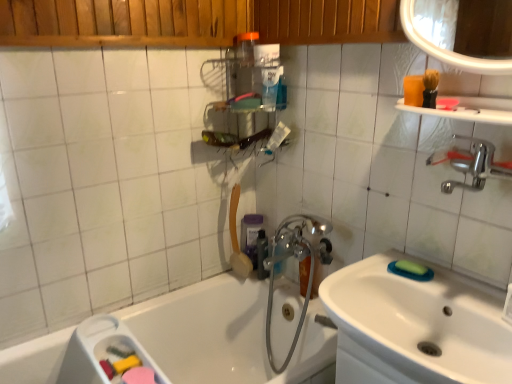
The image size is (512, 384). In order to click on green sponge at sink in this screenshot , I will do `click(411, 268)`.

The height and width of the screenshot is (384, 512). Describe the element at coordinates (416, 326) in the screenshot. I see `white glossy sink at lower right` at that location.

Where is `white glossy sink at lower right`? This screenshot has height=384, width=512. white glossy sink at lower right is located at coordinates (416, 326).

Measure the distance between black plastic bottle at center, placed as the second toiletry when sorted from front to back, and camera.

The distance of black plastic bottle at center, placed as the second toiletry when sorted from front to back, from camera is 1.79 meters.

This screenshot has height=384, width=512. Describe the element at coordinates (262, 254) in the screenshot. I see `black plastic bottle at center, the third toiletry viewed from the top` at that location.

Where is `transparent plastic bottle at upper center, the 1th toiletry positioned from the top`? transparent plastic bottle at upper center, the 1th toiletry positioned from the top is located at coordinates (245, 47).

This screenshot has height=384, width=512. I want to click on green sponge at sink, so click(x=411, y=268).

This screenshot has height=384, width=512. What are the coordinates of `toiletry that is the 3rd one when counting rightward from the matte orange shower head at upper center` in the screenshot? It's located at (262, 254).

Considering the points (262, 272) and (237, 274), which point is in front, point (262, 272) or point (237, 274)?

Positioned in front is point (262, 272).

From the image's perspective, which is below, black plastic bottle at center, the second toiletry positioned from the back, or matte orange shower head at upper center?

black plastic bottle at center, the second toiletry positioned from the back, from the image's perspective.

Which object is further away from the camera, black plastic bottle at center, the third toiletry viewed from the top, or matte orange shower head at upper center?

Positioned behind is black plastic bottle at center, the third toiletry viewed from the top.

From the image's perspective, which is below, chrome metallic faucet at center or green sponge at sink?

chrome metallic faucet at center appears lower in the image.

Is chrome metallic faucet at center bigger or smaller than green sponge at sink?

Clearly, chrome metallic faucet at center is larger in size than green sponge at sink.

Is chrome metallic faucet at center turned away from green sponge at sink?

chrome metallic faucet at center is not turned away from green sponge at sink.

Considering the sizes of objects chrome metallic faucet at center and green sponge at sink in the image provided, who is shorter, chrome metallic faucet at center or green sponge at sink?

Standing shorter between the two is green sponge at sink.

Could you measure the distance between metallic silver shelf at upper center and transparent plastic bottle at upper center, arranged as the first toiletry when viewed from the front?

metallic silver shelf at upper center is 6.39 inches away from transparent plastic bottle at upper center, arranged as the first toiletry when viewed from the front.

From a real-world perspective, which object rests below the other?

metallic silver shelf at upper center is physically lower.

From the image's perspective, who appears lower, metallic silver shelf at upper center or transparent plastic bottle at upper center, the 1th toiletry positioned from the top?

metallic silver shelf at upper center.

Considering the sizes of objects metallic silver shelf at upper center and transparent plastic bottle at upper center, the 3th toiletry in the bottom-to-top sequence, in the image provided, who is smaller, metallic silver shelf at upper center or transparent plastic bottle at upper center, the 3th toiletry in the bottom-to-top sequence,?

Smaller between the two is transparent plastic bottle at upper center, the 3th toiletry in the bottom-to-top sequence.

Is matte orange shower head at upper center far from chrome metallic faucet at center?

No, there isn't a large distance between matte orange shower head at upper center and chrome metallic faucet at center.

Considering the relative sizes of matte orange shower head at upper center and chrome metallic faucet at center in the image provided, is matte orange shower head at upper center wider than chrome metallic faucet at center?

No, matte orange shower head at upper center is not wider than chrome metallic faucet at center.

Is matte orange shower head at upper center further to camera compared to chrome metallic faucet at center?

Yes, it is.

Which object is further away from the camera taking this photo, black plastic bottle at center, the third toiletry viewed from the top, or metallic silver shelf at upper center?

black plastic bottle at center, the third toiletry viewed from the top, is further from the camera.

From a real-world perspective, who is located lower, black plastic bottle at center, the second toiletry positioned from the back, or metallic silver shelf at upper center?

In real-world perspective, black plastic bottle at center, the second toiletry positioned from the back, is lower.

You are a GUI agent. You are given a task and a screenshot of the screen. Output one action in this format:
    pyautogui.click(x=<x>, y=<y>)
    Task: Click on the 2nd toiletry behind the metallic silver shelf at upper center
    The image size is (512, 384).
    Given the screenshot: What is the action you would take?
    pyautogui.click(x=262, y=254)

Would you consider black plastic bottle at center, the first toiletry in the bottom-to-top sequence, to be distant from metallic silver shelf at upper center?

No, there isn't a large distance between black plastic bottle at center, the first toiletry in the bottom-to-top sequence, and metallic silver shelf at upper center.

Which of these two, matte orange shower head at upper center or transparent plastic bottle at upper center, arranged as the first toiletry when viewed from the front, is wider?

Wider between the two is matte orange shower head at upper center.

Between matte orange shower head at upper center and transparent plastic bottle at upper center, the 1th toiletry positioned from the top, which one appears on the left side from the viewer's perspective?

Positioned to the left is matte orange shower head at upper center.

Who is more distant, matte orange shower head at upper center or transparent plastic bottle at upper center, arranged as the first toiletry when viewed from the front?

matte orange shower head at upper center.

Can transparent plastic bottle at upper center, arranged as the first toiletry when viewed from the front, be found inside matte orange shower head at upper center?

No, matte orange shower head at upper center does not contain transparent plastic bottle at upper center, arranged as the first toiletry when viewed from the front.

Does chrome metallic faucet at center come behind white glossy sink at lower right?

Yes, it is behind white glossy sink at lower right.

Would you consider chrome metallic faucet at center to be distant from white glossy sink at lower right?

chrome metallic faucet at center is near white glossy sink at lower right, not far away.

Does point (303, 216) appear closer or farther from the camera than point (446, 321)?

Point (303, 216) appears to be farther away from the viewer than point (446, 321).

Does chrome metallic faucet at center have a smaller size compared to white glossy sink at lower right?

Actually, chrome metallic faucet at center might be larger than white glossy sink at lower right.

Identify the location of shower located in front of the black plastic bottle at center, placed as the second toiletry when sorted from front to back. The height and width of the screenshot is (384, 512). (237, 238).

The height and width of the screenshot is (384, 512). Identify the location of plumbing fixture behind the green sponge at sink. (298, 267).

Estimate the real-world distances between objects in this image. Which object is further from transparent plastic bottle at upper center, which is the 3th toiletry from back to front, white glossy sink at lower right or green sponge at sink?

white glossy sink at lower right lies further to transparent plastic bottle at upper center, which is the 3th toiletry from back to front, than the other object.

When comparing their distances from purple matte soap dispenser at upper center, placed as the 1th toiletry when sorted from back to front, does green sponge at sink or white glossy sink at lower right seem closer?

green sponge at sink is closer to purple matte soap dispenser at upper center, placed as the 1th toiletry when sorted from back to front.

Based on the photo, which object lies further to the anchor point chrome metallic faucet at center, white glossy sink at lower right or transparent plastic bottle at upper center, which is the 3th toiletry from back to front?

transparent plastic bottle at upper center, which is the 3th toiletry from back to front.

Considering their positions, is white glossy sink at lower right positioned closer to transparent plastic bottle at upper center, arranged as the first toiletry when viewed from the front, than chrome metallic faucet at center?

Among the two, chrome metallic faucet at center is located nearer to transparent plastic bottle at upper center, arranged as the first toiletry when viewed from the front.

Which object lies further to the anchor point white glossy sink at lower right, chrome metallic faucet at center or purple matte soap dispenser at upper center, placed as the 1th toiletry when sorted from back to front?

purple matte soap dispenser at upper center, placed as the 1th toiletry when sorted from back to front, lies further to white glossy sink at lower right than the other object.

Considering their positions, is metallic silver shelf at upper center positioned further to chrome metallic faucet at center than matte orange shower head at upper center?

metallic silver shelf at upper center is positioned further to the anchor chrome metallic faucet at center.

Looking at the image, which one is located further to white glossy sink at lower right, transparent plastic bottle at upper center, which is the 3th toiletry from back to front, or black plastic bottle at center, the first toiletry in the bottom-to-top sequence?

Based on the image, transparent plastic bottle at upper center, which is the 3th toiletry from back to front, appears to be further to white glossy sink at lower right.

Estimate the real-world distances between objects in this image. Which object is further from black plastic bottle at center, placed as the second toiletry when sorted from front to back, metallic silver shelf at upper center or chrome metallic faucet at center?

Among the two, metallic silver shelf at upper center is located further to black plastic bottle at center, placed as the second toiletry when sorted from front to back.

Locate an element on the screen. shower between metallic silver shelf at upper center and purple matte soap dispenser at upper center, which ranks as the 2th toiletry in top-to-bottom order, in the up-down direction is located at coordinates (237, 238).

Where is `soap between white glossy sink at lower right and black plastic bottle at center, the first toiletry in the bottom-to-top sequence, in the front-back direction`? soap between white glossy sink at lower right and black plastic bottle at center, the first toiletry in the bottom-to-top sequence, in the front-back direction is located at coordinates (411, 268).

Locate an element on the screen. This screenshot has width=512, height=384. plumbing fixture positioned between green sponge at sink and purple matte soap dispenser at upper center, which ranks as the 2th toiletry in top-to-bottom order, from near to far is located at coordinates (298, 267).

Where is `plumbing fixture positioned between green sponge at sink and black plastic bottle at center, the first toiletry in the bottom-to-top sequence, from near to far`? plumbing fixture positioned between green sponge at sink and black plastic bottle at center, the first toiletry in the bottom-to-top sequence, from near to far is located at coordinates (298, 267).